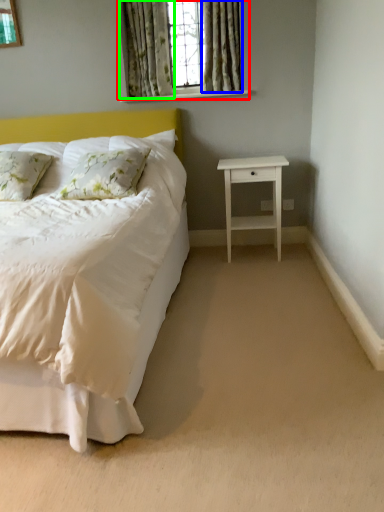
Question: Considering the real-world distances, which object is closest to window (highlighted by a red box)? curtain (highlighted by a blue box) or curtain (highlighted by a green box).

Choices:
 (A) curtain
 (B) curtain

Answer: (B)